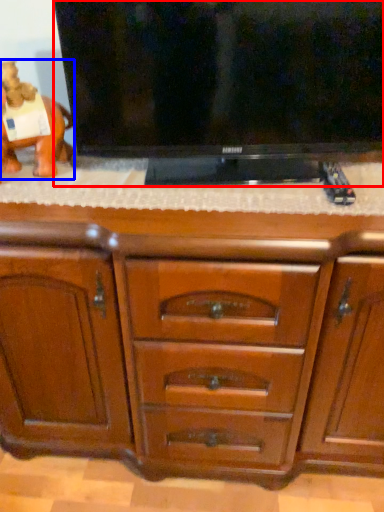
Question: Which object is further to the camera taking this photo, television (highlighted by a red box) or animal (highlighted by a blue box)?

Choices:
 (A) television
 (B) animal

Answer: (B)